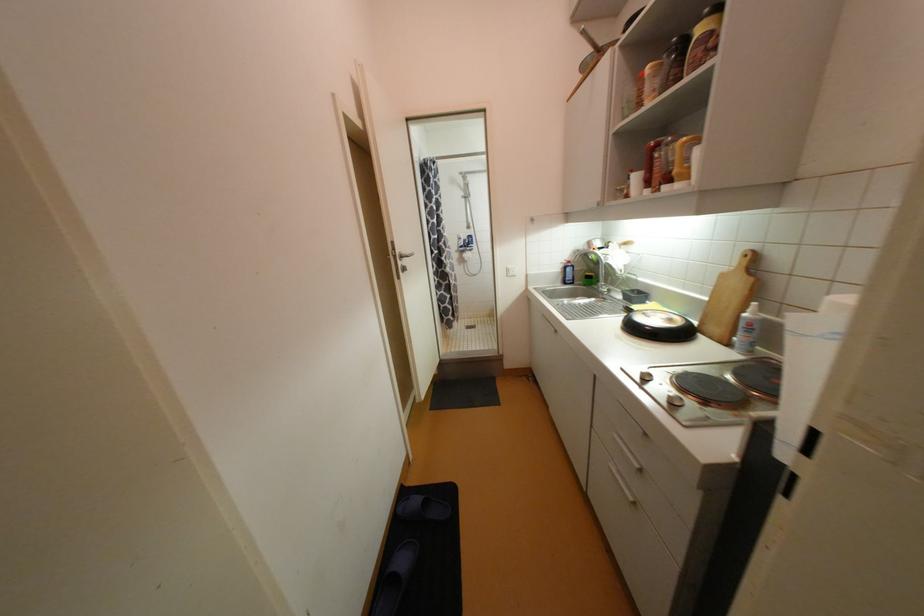
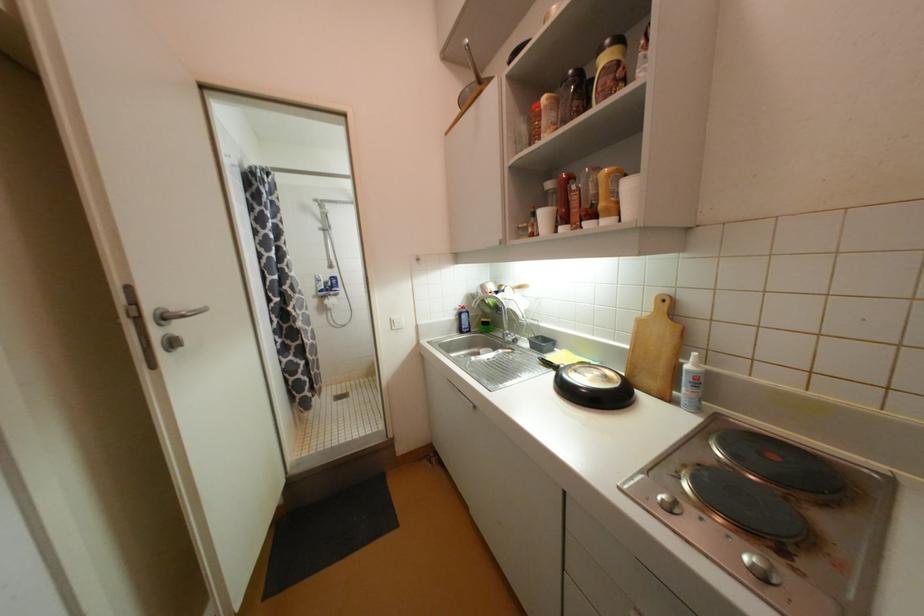
The point at (x=675, y=180) is marked in the first image. Where is the corresponding point in the second image?

(600, 217)